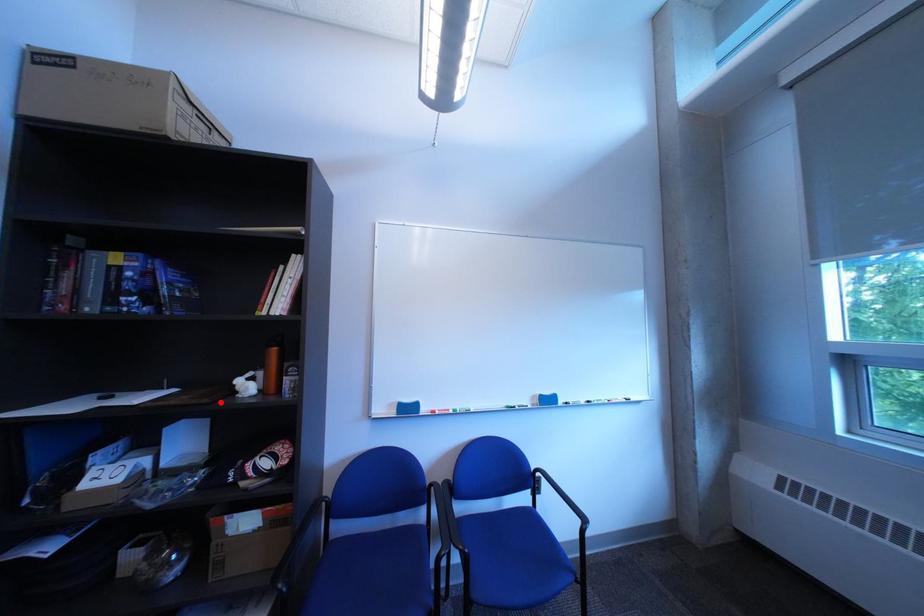
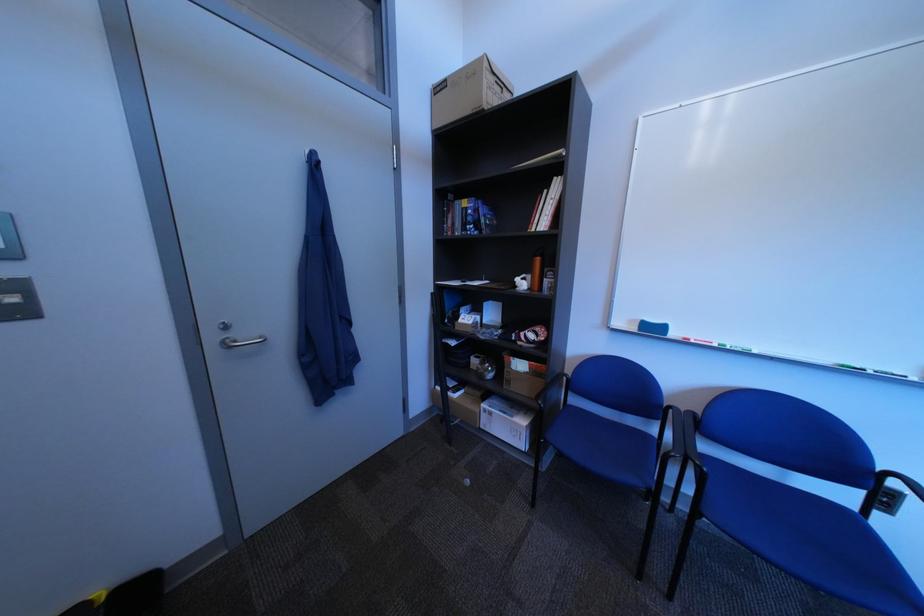
In the second image, find the point that corresponds to the highlighted location in the first image.

(517, 290)